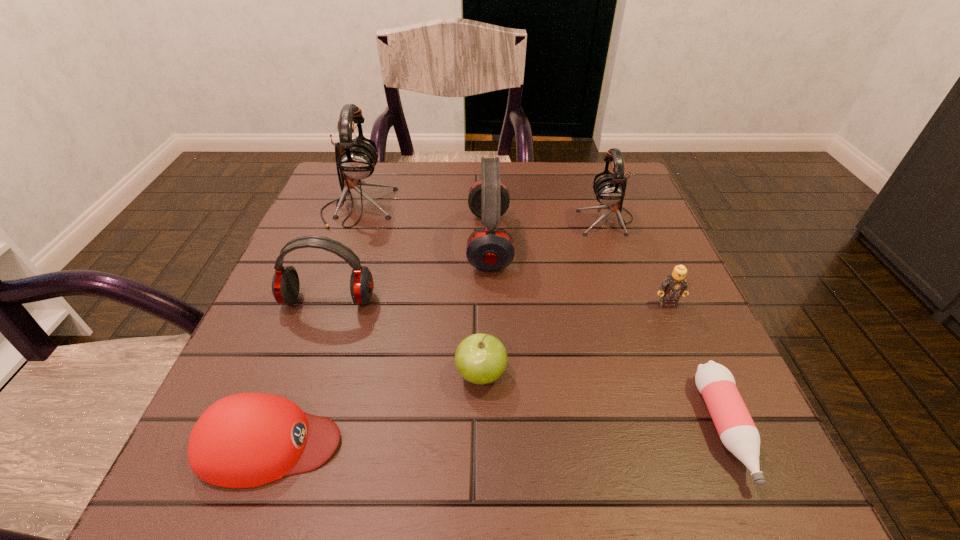
Where is `object that stands as the fourth closest to the left black earphone`? This screenshot has width=960, height=540. object that stands as the fourth closest to the left black earphone is located at coordinates (609, 189).

The height and width of the screenshot is (540, 960). In order to click on the closest earphone to the fifth shortest object in this screenshot , I will do `click(490, 248)`.

Select which earphone is the fourth closest to the pink bottle. Please provide its 2D coordinates. Your answer should be formatted as a tuple, i.e. [(x, y)], where the tuple contains the x and y coordinates of a point satisfying the conditions above.

[(356, 159)]

Locate an element on the screen. vacant space that satisfies the following two spatial constraints: 1. on the ear cups of the third earphone from left to right; 2. on the ear cups of the fourth tallest object is located at coordinates (491, 300).

At what (x,y) coordinates should I click in order to perform the action: click on free space in the image that satisfies the following two spatial constraints: 1. on the ear cups of the fifth shortest object; 2. on the front-facing side of the baseball cap. Please return your answer as a coordinate pair (x, y). The width and height of the screenshot is (960, 540). Looking at the image, I should click on (278, 444).